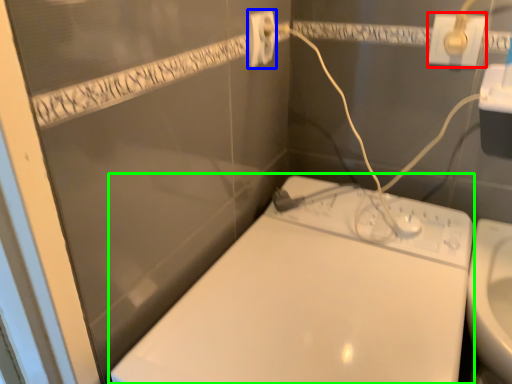
Question: Which object is positioned farthest from power plugs and sockets (highlighted by a red box)? Select from power plugs and sockets (highlighted by a blue box) and toilet (highlighted by a green box).

Choices:
 (A) power plugs and sockets
 (B) toilet

Answer: (B)